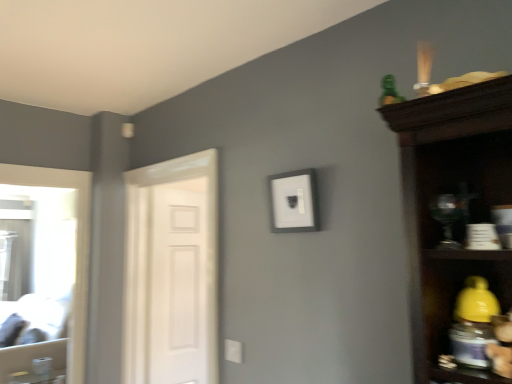
Question: Can we say green plastic toy at upper right lies outside white painted wood door at left?

Choices:
 (A) no
 (B) yes

Answer: (B)

Question: Is green plastic toy at upper right turned away from white painted wood door at left?

Choices:
 (A) no
 (B) yes

Answer: (A)

Question: Would you consider green plastic toy at upper right to be distant from white painted wood door at left?

Choices:
 (A) no
 (B) yes

Answer: (B)

Question: Is green plastic toy at upper right wider than white painted wood door at left?

Choices:
 (A) no
 (B) yes

Answer: (A)

Question: Is white painted wood door at left located within green plastic toy at upper right?

Choices:
 (A) yes
 (B) no

Answer: (B)

Question: Is point (181, 263) positioned closer to the camera than point (275, 198)?

Choices:
 (A) closer
 (B) farther

Answer: (B)

Question: From the image's perspective, is white matte door at left positioned above or below white matte picture frame at center?

Choices:
 (A) above
 (B) below

Answer: (B)

Question: In terms of width, does white matte door at left look wider or thinner when compared to white matte picture frame at center?

Choices:
 (A) wide
 (B) thin

Answer: (A)

Question: Would you say white matte door at left is inside or outside white matte picture frame at center?

Choices:
 (A) inside
 (B) outside

Answer: (B)

Question: Is white painted wood door at left situated inside white matte picture frame at center or outside?

Choices:
 (A) outside
 (B) inside

Answer: (A)

Question: Considering the positions of white painted wood door at left and white matte picture frame at center in the image, is white painted wood door at left bigger or smaller than white matte picture frame at center?

Choices:
 (A) big
 (B) small

Answer: (A)

Question: Does point (181, 309) appear closer or farther from the camera than point (305, 173)?

Choices:
 (A) closer
 (B) farther

Answer: (B)

Question: In the image, is white painted wood door at left on the left side or the right side of white matte picture frame at center?

Choices:
 (A) left
 (B) right

Answer: (A)

Question: Is green plastic toy at upper right bigger or smaller than white matte picture frame at center?

Choices:
 (A) big
 (B) small

Answer: (B)

Question: From a real-world perspective, relative to white matte picture frame at center, is green plastic toy at upper right vertically above or below?

Choices:
 (A) below
 (B) above

Answer: (B)